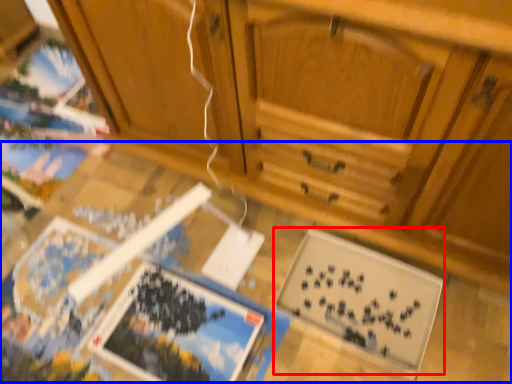
Question: Which object is closer to the camera taking this photo, magazine (highlighted by a red box) or table (highlighted by a blue box)?

Choices:
 (A) magazine
 (B) table

Answer: (B)